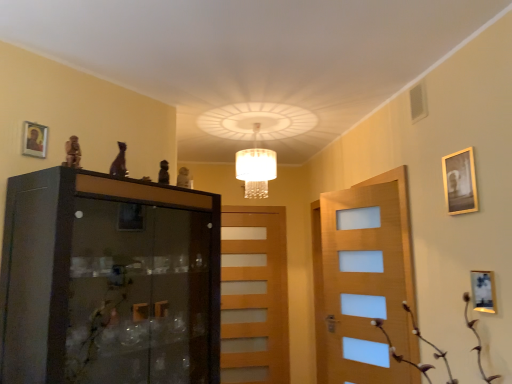
You are a GUI agent. You are given a task and a screenshot of the screen. Output one action in this format:
    pyautogui.click(x=<x>, y=<y>)
    Task: Click on the brown textured plant at lower right
    The image size is (512, 384).
    Given the screenshot: What is the action you would take?
    pyautogui.click(x=401, y=355)

What do you see at coordinates (256, 168) in the screenshot?
I see `white crystal chandelier at center` at bounding box center [256, 168].

What do you see at coordinates (34, 140) in the screenshot?
I see `gold-framed picture at upper left, the third picture frame from the bottom` at bounding box center [34, 140].

This screenshot has height=384, width=512. In order to click on brown textured plant at lower right in this screenshot , I will do `click(401, 355)`.

Is point (485, 287) positioned before point (137, 363)?

Yes, it is.

Image resolution: width=512 pixels, height=384 pixels. I want to click on cabinetry on the left of the wooden picture frame at right, the 3th picture frame positioned from the left, so click(109, 281).

Which object is wider, wooden picture frame at right, which is the third picture frame from top to bottom, or black glass cabinet at left?

With larger width is black glass cabinet at left.

From the image's perspective, is wooden picture frame at right, which appears as the 1th picture frame when ordered from the bottom, positioned above or below black glass cabinet at left?

From the image's perspective, wooden picture frame at right, which appears as the 1th picture frame when ordered from the bottom, appears above black glass cabinet at left.

Is wooden picture frame at right, which is the third picture frame from top to bottom, wider or thinner than white crystal chandelier at center?

In the image, wooden picture frame at right, which is the third picture frame from top to bottom, appears to be more narrow than white crystal chandelier at center.

Is white crystal chandelier at center at the back of wooden picture frame at right, which is the third picture frame from top to bottom?

No, wooden picture frame at right, which is the third picture frame from top to bottom, is not facing away from white crystal chandelier at center.

Does point (484, 292) come behind point (254, 190)?

That is False.

Is wooden picture frame at right, the 3th picture frame positioned from the left, situated inside white crystal chandelier at center or outside?

The correct answer is: outside.

Is point (493, 309) positioned in front of point (229, 295)?

Yes, point (493, 309) is in front of point (229, 295).

What's the angular difference between wooden picture frame at right, which appears as the 1th picture frame when ordered from the bottom, and light brown wooden door at center's facing directions?

The angle between the facing direction of wooden picture frame at right, which appears as the 1th picture frame when ordered from the bottom, and the facing direction of light brown wooden door at center is 91.3 degrees.

Is wooden picture frame at right, the first picture frame when ordered from right to left, in contact with light brown wooden door at center?

No.

Measure the distance between wooden picture frame at right, which is the third picture frame from top to bottom, and light brown wooden door at center.

9.69 feet.

Does brown textured plant at lower right turn towards wooden picture frame at right, the first picture frame when ordered from right to left?

No, brown textured plant at lower right is not facing towards wooden picture frame at right, the first picture frame when ordered from right to left.

Can we say brown textured plant at lower right lies outside wooden picture frame at right, which appears as the 1th picture frame when ordered from the bottom?

brown textured plant at lower right is positioned outside wooden picture frame at right, which appears as the 1th picture frame when ordered from the bottom.

In terms of size, does brown textured plant at lower right appear bigger or smaller than wooden picture frame at right, which is the third picture frame from top to bottom?

In the image, brown textured plant at lower right appears to be larger than wooden picture frame at right, which is the third picture frame from top to bottom.

From a real-world perspective, is brown textured plant at lower right below wooden picture frame at right, the 3th picture frame positioned from the left?

Yes, from a real-world perspective, brown textured plant at lower right is beneath wooden picture frame at right, the 3th picture frame positioned from the left.

From the image's perspective, is wooden picture frame at right, the 3th picture frame positioned from the left, on brown textured plant at lower right?

Indeed, from the image's perspective, wooden picture frame at right, the 3th picture frame positioned from the left, is shown above brown textured plant at lower right.

Relative to brown textured plant at lower right, is wooden picture frame at right, which appears as the 1th picture frame when ordered from the bottom, in front or behind?

Visually, wooden picture frame at right, which appears as the 1th picture frame when ordered from the bottom, is located behind brown textured plant at lower right.

Does wooden picture frame at right, which appears as the 1th picture frame when ordered from the bottom, appear on the left side of brown textured plant at lower right?

No, wooden picture frame at right, which appears as the 1th picture frame when ordered from the bottom, is not to the left of brown textured plant at lower right.

Which is closer to the camera, (x=267, y=196) or (x=455, y=180)?

Positioned in front is point (x=455, y=180).

Is white crystal chandelier at center to the right of gold metallic picture frame at upper right, the second picture frame ordered from the bottom, from the viewer's perspective?

No, white crystal chandelier at center is not to the right of gold metallic picture frame at upper right, the second picture frame ordered from the bottom.

From the white crystal chandelier at center, count 2nd picture frames forward and point to it. Please provide its 2D coordinates.

[(460, 182)]

Looking at this image, looking at their sizes, would you say gold metallic picture frame at upper right, the 2th picture frame positioned from the right, is wider or thinner than white crystal chandelier at center?

gold metallic picture frame at upper right, the 2th picture frame positioned from the right, is thinner than white crystal chandelier at center.

Which object is further away from the camera, gold metallic picture frame at upper right, the second picture frame ordered from the bottom, or white crystal chandelier at center?

white crystal chandelier at center is further away from the camera.

Is white crystal chandelier at center a part of gold metallic picture frame at upper right, the 2th picture frame when ordered from top to bottom?

No, white crystal chandelier at center is not surrounded by gold metallic picture frame at upper right, the 2th picture frame when ordered from top to bottom.

From a real-world perspective, is gold metallic picture frame at upper right, the second picture frame ordered from the bottom, above or below white crystal chandelier at center?

gold metallic picture frame at upper right, the second picture frame ordered from the bottom, is situated lower than white crystal chandelier at center in the real world.

I want to click on picture frame that is the 1st one when counting backward from the black glass cabinet at left, so click(x=483, y=291).

What are the coordinates of `picture frame that is the 3rd object directly below the white crystal chandelier at center (from a real-world perspective)` in the screenshot? It's located at (483, 291).

From the image, which object appears to be nearer to black glass cabinet at left, brown textured plant at lower right or light brown wooden door at center?

brown textured plant at lower right lies closer to black glass cabinet at left than the other object.

Considering their positions, is white crystal chandelier at center positioned further to gold-framed picture at upper left, which appears as the first picture frame when viewed from the left, than brown textured plant at lower right?

brown textured plant at lower right.

Based on the photo, considering their positions, is wooden picture frame at right, which appears as the 1th picture frame when ordered from the bottom, positioned closer to gold metallic picture frame at upper right, the second picture frame ordered from the bottom, than black glass cabinet at left?

The object closer to gold metallic picture frame at upper right, the second picture frame ordered from the bottom, is wooden picture frame at right, which appears as the 1th picture frame when ordered from the bottom.

Based on their spatial positions, is light brown wooden door at center or wooden picture frame at right, which is the third picture frame from top to bottom, closer to brown textured plant at lower right?

Among the two, wooden picture frame at right, which is the third picture frame from top to bottom, is located nearer to brown textured plant at lower right.

From the image, which object appears to be nearer to white crystal chandelier at center, gold metallic picture frame at upper right, the 2th picture frame positioned from the right, or wooden picture frame at right, which is the third picture frame from top to bottom?

gold metallic picture frame at upper right, the 2th picture frame positioned from the right.

Estimate the real-world distances between objects in this image. Which object is closer to gold-framed picture at upper left, placed as the 1th picture frame when sorted from top to bottom, wooden picture frame at right, which is the third picture frame from top to bottom, or black glass cabinet at left?

Based on the image, black glass cabinet at left appears to be nearer to gold-framed picture at upper left, placed as the 1th picture frame when sorted from top to bottom.

Estimate the real-world distances between objects in this image. Which object is further from brown textured plant at lower right, gold-framed picture at upper left, the third picture frame from the bottom, or white crystal chandelier at center?

gold-framed picture at upper left, the third picture frame from the bottom, is positioned further to the anchor brown textured plant at lower right.

Considering their positions, is gold-framed picture at upper left, which ranks as the 3th picture frame in right-to-left order, positioned closer to light brown wooden door at center than gold metallic picture frame at upper right, the second picture frame ordered from the bottom?

gold metallic picture frame at upper right, the second picture frame ordered from the bottom, is closer to light brown wooden door at center.

The image size is (512, 384). Identify the location of lamp between gold metallic picture frame at upper right, acting as the 2th picture frame starting from the left, and light brown wooden door at center in the front-back direction. (256, 168).

Identify the location of lamp situated between gold-framed picture at upper left, the third picture frame from the bottom, and wooden picture frame at right, the first picture frame when ordered from right to left, from left to right. The width and height of the screenshot is (512, 384). (256, 168).

This screenshot has width=512, height=384. What are the coordinates of `plant located between gold-framed picture at upper left, placed as the 1th picture frame when sorted from top to bottom, and wooden picture frame at right, which is the third picture frame from top to bottom, in the left-right direction` in the screenshot? It's located at (401, 355).

Where is `cabinetry between brown textured plant at lower right and white crystal chandelier at center along the z-axis`? The image size is (512, 384). cabinetry between brown textured plant at lower right and white crystal chandelier at center along the z-axis is located at coordinates (109, 281).